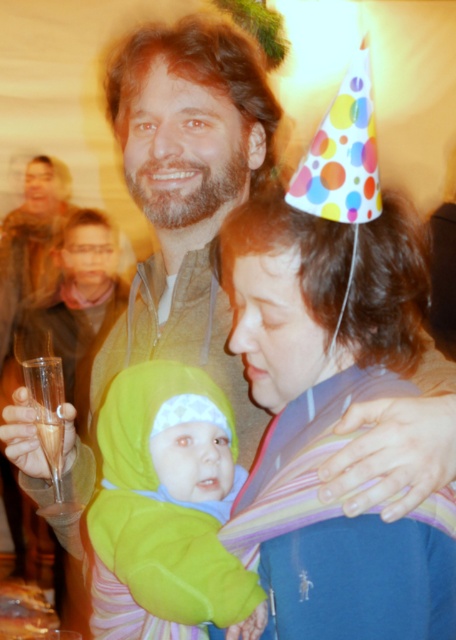
Is point (311, 420) closer to camera compared to point (109, 561)?

Yes, it is in front of point (109, 561).

Between point (270, 348) and point (195, 515), which one is positioned behind?

The point (270, 348) is more distant.

Identify the location of matte purple scarf at center. The image size is (456, 640). (331, 420).